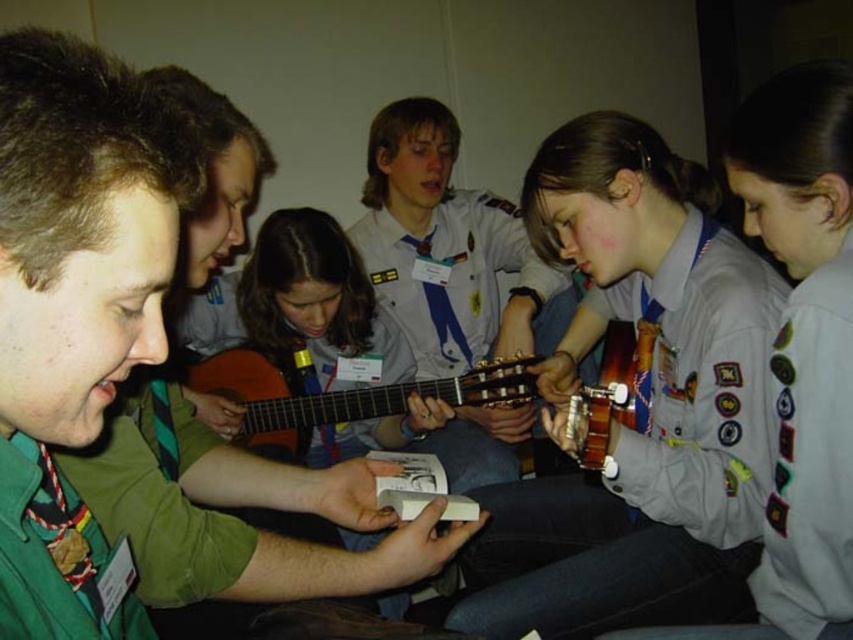
Is matte gray uniform at center shorter than light gray uniform at center?

In fact, matte gray uniform at center may be taller than light gray uniform at center.

Is matte gray uniform at center to the right of light gray uniform at center from the viewer's perspective?

In fact, matte gray uniform at center is to the left of light gray uniform at center.

The width and height of the screenshot is (853, 640). Find the location of `matte gray uniform at center`. matte gray uniform at center is located at coordinates (637, 401).

Is matte gray uniform at center further to the viewer compared to wooden acoustic guitar at center?

No, matte gray uniform at center is closer to the viewer.

Between matte gray uniform at center and wooden acoustic guitar at center, which one has less height?

wooden acoustic guitar at center is shorter.

Where is `matte gray uniform at center`? Image resolution: width=853 pixels, height=640 pixels. matte gray uniform at center is located at coordinates (637, 401).

Is matte brown guitar at center closer to camera compared to wooden acoustic guitar at center?

No, it is not.

Is matte brown guitar at center wider than wooden acoustic guitar at center?

In fact, matte brown guitar at center might be narrower than wooden acoustic guitar at center.

Does point (347, 310) lie behind point (239, 355)?

That is False.

This screenshot has width=853, height=640. Find the location of `matte brown guitar at center`. matte brown guitar at center is located at coordinates (315, 294).